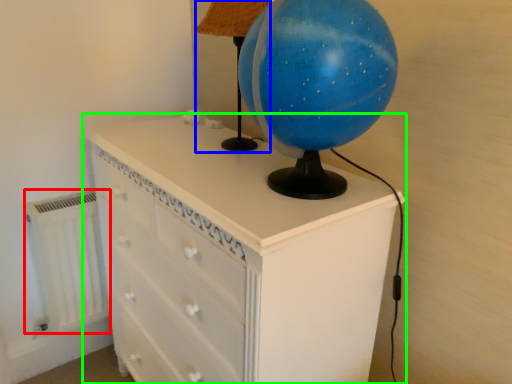
Question: Which object is the farthest from radiator (highlighted by a red box)? Choose among these: table lamp (highlighted by a blue box) or chest of drawers (highlighted by a green box).

Choices:
 (A) table lamp
 (B) chest of drawers

Answer: (A)